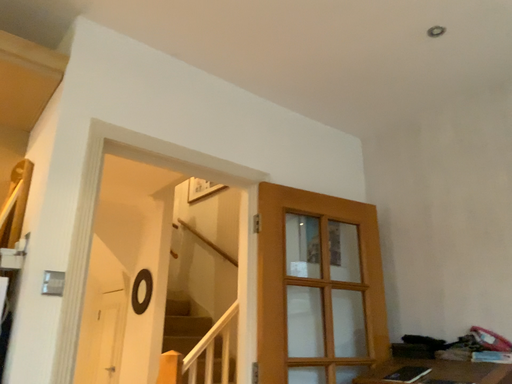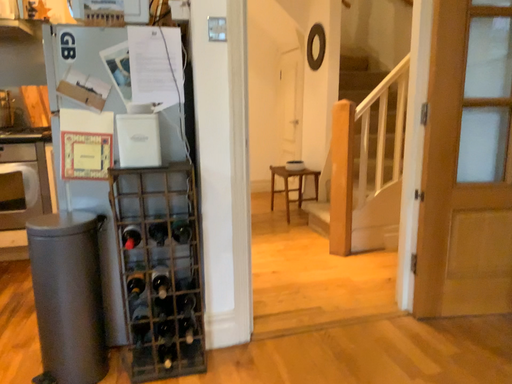
Question: How did the camera likely rotate when shooting the video?

Choices:
 (A) rotated right
 (B) rotated left

Answer: (B)